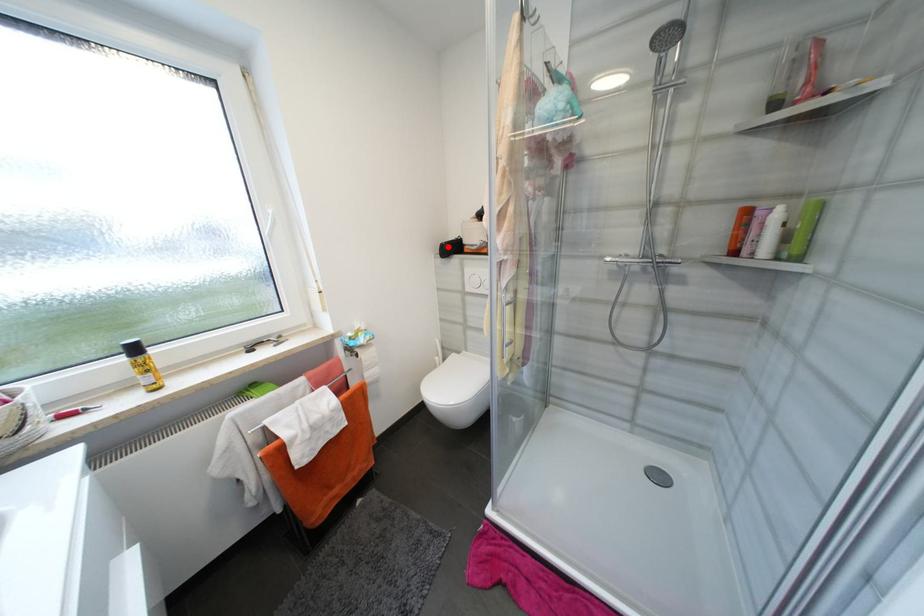
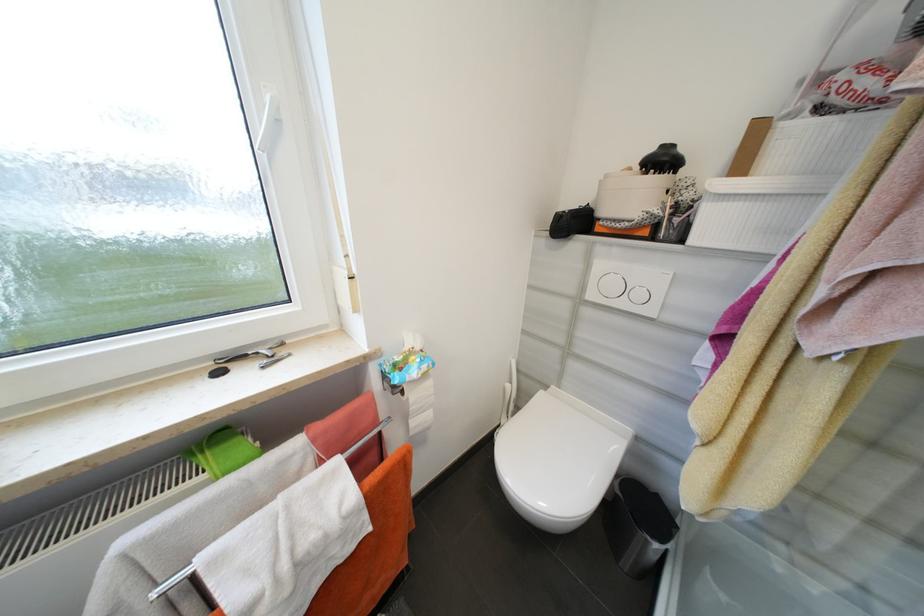
Find the pixel in the second image that matches the highlighted location in the first image.

(565, 217)